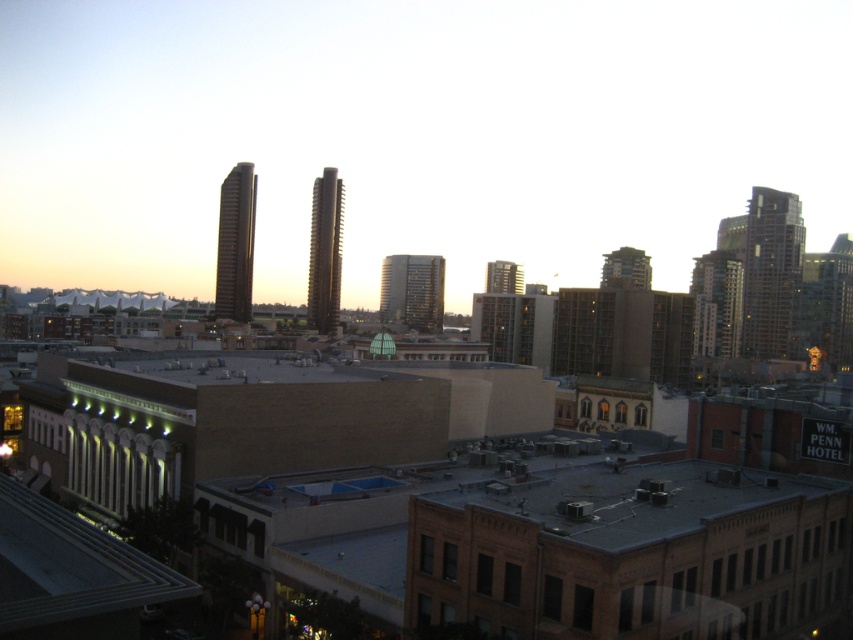
Is point (28, 403) farther from camera compared to point (219, 316)?

No, it is not.

The width and height of the screenshot is (853, 640). I want to click on brown brick building at center, so click(442, 492).